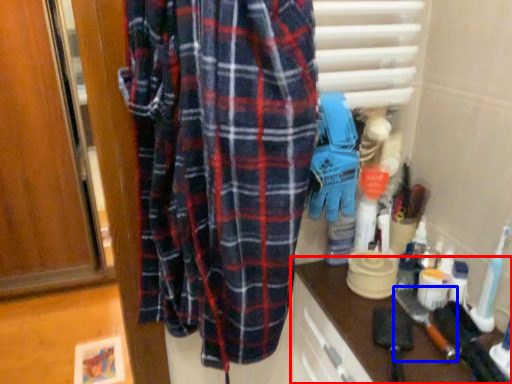
Question: Which object appears farthest to the camera in this image, counter (highlighted by a red box) or brush (highlighted by a blue box)?

Choices:
 (A) counter
 (B) brush

Answer: (B)